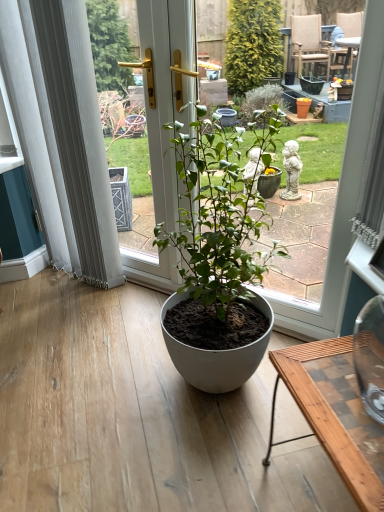
What are the coordinates of `free spot in front of matte white pot at center` in the screenshot? It's located at (201, 455).